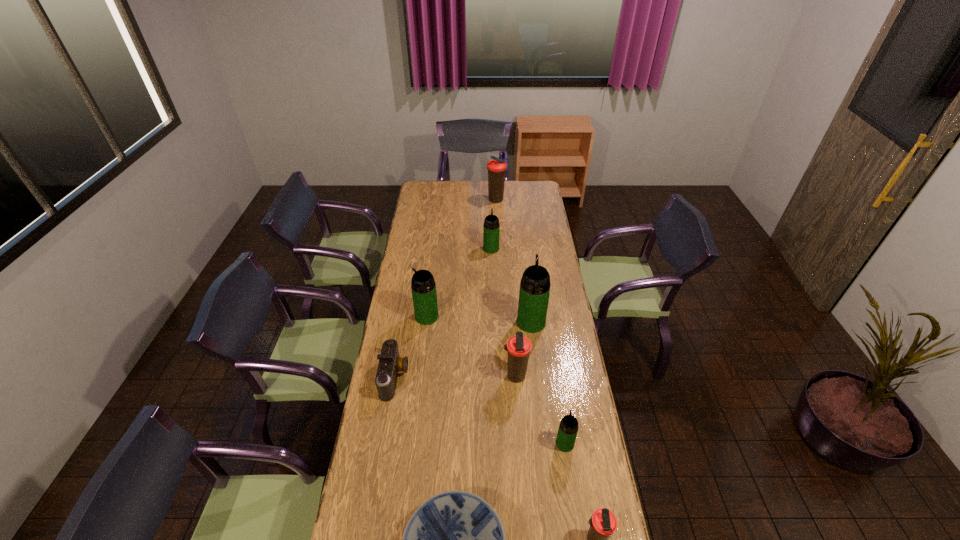
Locate an element on the screen. The width and height of the screenshot is (960, 540). the biggest green thermos bottle is located at coordinates (534, 292).

Locate an element on the screen. This screenshot has width=960, height=540. the tallest object is located at coordinates (534, 292).

Where is `the biggest brown thermos bottle`? This screenshot has width=960, height=540. the biggest brown thermos bottle is located at coordinates (496, 168).

I want to click on the farthest thermos bottle, so click(x=496, y=168).

This screenshot has width=960, height=540. I want to click on the leftmost thermos bottle, so click(423, 286).

Locate an element on the screen. Image resolution: width=960 pixels, height=540 pixels. the second biggest green thermos bottle is located at coordinates (423, 286).

I want to click on the third biggest green thermos bottle, so click(491, 228).

At what (x,y) coordinates should I click in order to perform the action: click on the farthest green thermos bottle. Please return your answer as a coordinate pair (x, y). Image resolution: width=960 pixels, height=540 pixels. Looking at the image, I should click on (491, 228).

Where is `the second nearest brown thermos bottle`? the second nearest brown thermos bottle is located at coordinates (518, 347).

The image size is (960, 540). In order to click on the fifth farthest thermos bottle in this screenshot , I will do `click(518, 347)`.